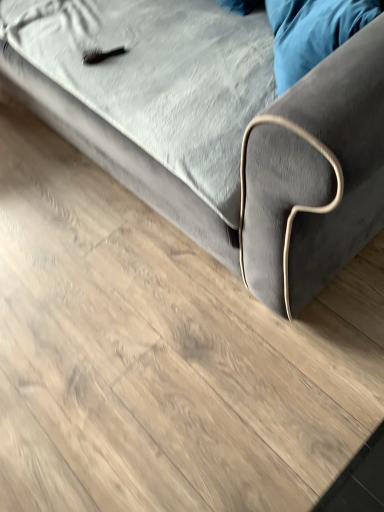
Question: From the image's perspective, would you say velvet blue pillow at upper right is shown under velvet gray couch at upper center?

Choices:
 (A) yes
 (B) no

Answer: (A)

Question: Is velvet blue pillow at upper right with velvet gray couch at upper center?

Choices:
 (A) no
 (B) yes

Answer: (A)

Question: Is the depth of velvet blue pillow at upper right greater than that of velvet gray couch at upper center?

Choices:
 (A) yes
 (B) no

Answer: (A)

Question: Is velvet blue pillow at upper right looking in the opposite direction of velvet gray couch at upper center?

Choices:
 (A) yes
 (B) no

Answer: (A)

Question: Can velvet gray couch at upper center be found inside velvet blue pillow at upper right?

Choices:
 (A) yes
 (B) no

Answer: (B)

Question: Are velvet blue pillow at upper right and velvet gray couch at upper center located far from each other?

Choices:
 (A) no
 (B) yes

Answer: (A)

Question: Can you confirm if velvet gray couch at upper center is smaller than velvet blue pillow at upper right?

Choices:
 (A) no
 (B) yes

Answer: (A)

Question: Is velvet gray couch at upper center taller than velvet blue pillow at upper right?

Choices:
 (A) no
 (B) yes

Answer: (B)

Question: Is velvet gray couch at upper center with velvet blue pillow at upper right?

Choices:
 (A) no
 (B) yes

Answer: (A)

Question: Is velvet gray couch at upper center further to camera compared to velvet blue pillow at upper right?

Choices:
 (A) yes
 (B) no

Answer: (B)

Question: Considering the relative positions of velvet gray couch at upper center and velvet blue pillow at upper right in the image provided, is velvet gray couch at upper center to the right of velvet blue pillow at upper right from the viewer's perspective?

Choices:
 (A) no
 (B) yes

Answer: (A)

Question: From the image's perspective, is velvet gray couch at upper center below velvet blue pillow at upper right?

Choices:
 (A) no
 (B) yes

Answer: (A)

Question: Is velvet blue pillow at upper right spatially inside velvet gray couch at upper center, or outside of it?

Choices:
 (A) inside
 (B) outside

Answer: (A)